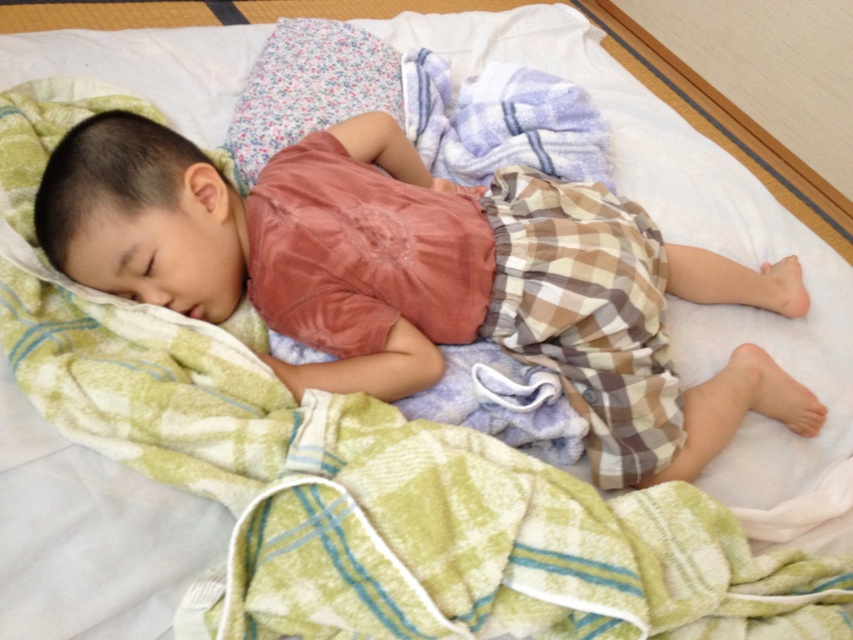
Based on the coordinates provided in the scene, where is the matte pink shirt at center located?

The matte pink shirt at center is located at point coordinates of 0.433 on the x axis and 0.496 on the y axis.

You are a photographer taking a picture of the child in the scene. You need to focus on the point at coordinates point (x=422, y=276). Which object in the scene is at that point?

The point (x=422, y=276) is on the matte pink shirt at center.

You are a parent checking on your child. You see the matte pink shirt at center and the floral fabric pillow at upper center. Which item is closer to you when you look at the bed?

The matte pink shirt at center is closer to you because it is in front of the floral fabric pillow at upper center.